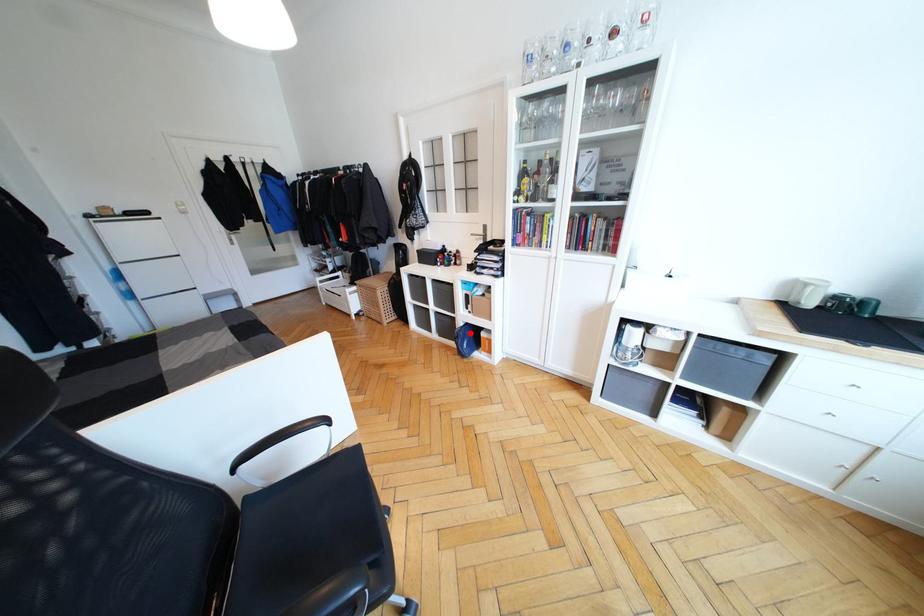
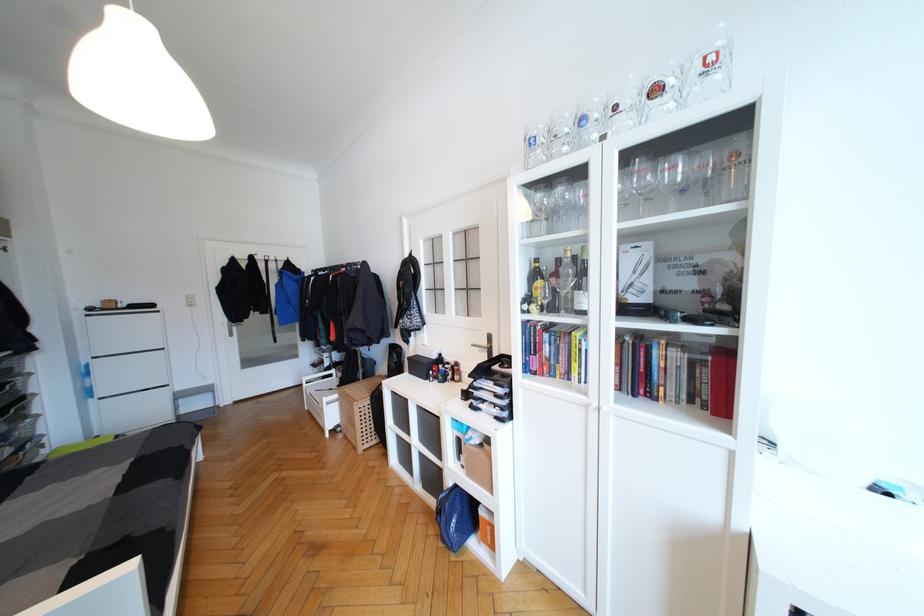
Question: A red point is marked in image1. In image2, is the corresponding 3D point closer to the camera or farther? Reply with the corresponding letter.

Choices:
 (A) The corresponding 3D point is closer.
 (B) The corresponding 3D point is farther.

Answer: (B)